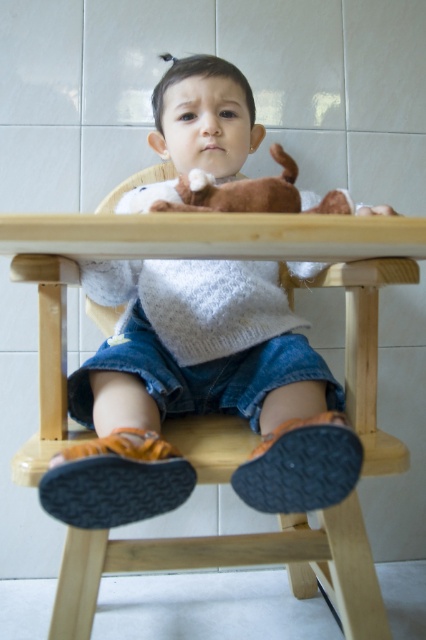
You are a photographer setting up for a photo shoot. You need to place a small prop exactly at the point with coordinates (x=198, y=394). According to the scene, where should you place the prop?

The point (x=198, y=394) is located on the white knitted sweater at center, so place the prop on the white knitted sweater at center.

In the scene shown: You are a parent trying to place a small toy on the table so your child can reach it while sitting in the high chair. The toy requires a minimum of 5 inches of space to be placed safely. Based on the scene, can the toy be placed between the white knitted sweater at center and the wooden table at center?

The distance between the white knitted sweater at center and the wooden table at center is 4.72 inches, which is less than the required 5 inches. Therefore, the toy cannot be placed safely between them.

You are a photographer standing in front of the high chair. You need to place a small toy exactly at the point labeled as point (325,369). The toy is 10 centimeters in diameter. Can you fit the toy at that point without it overlapping with any other objects in the scene?

The point (325,369) is 85.80 centimeters from the viewer. Since the toy is only 10 centimeters in diameter, there should be enough space to place it at that point without overlapping with other objects, provided the area is clear. However, the description does not mention any other objects at that specific location, so it is safe to assume the toy can be placed there.